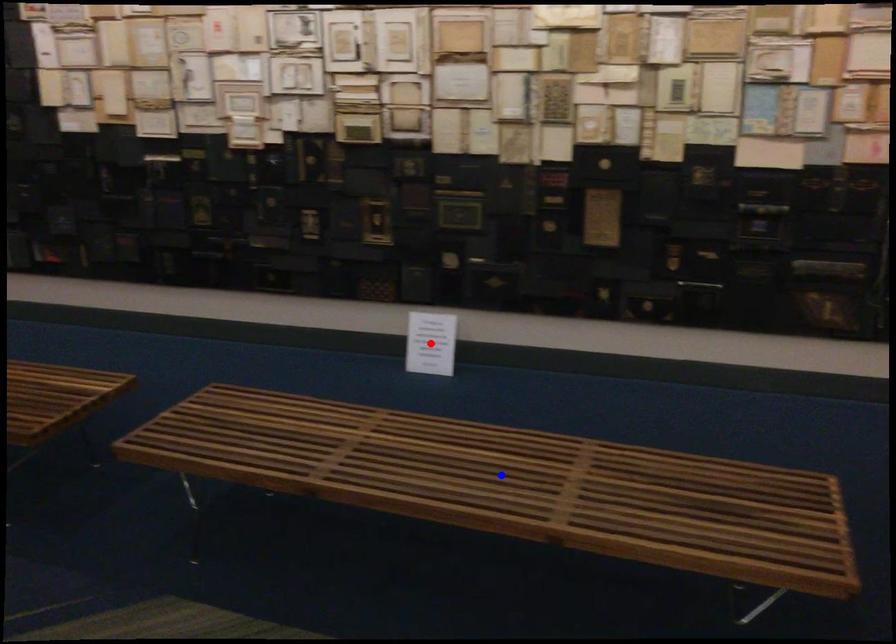
Question: In the image, two points are highlighted. Which point is nearer to the camera? Reply with the corresponding letter.

Choices:
 (A) blue point
 (B) red point

Answer: (A)